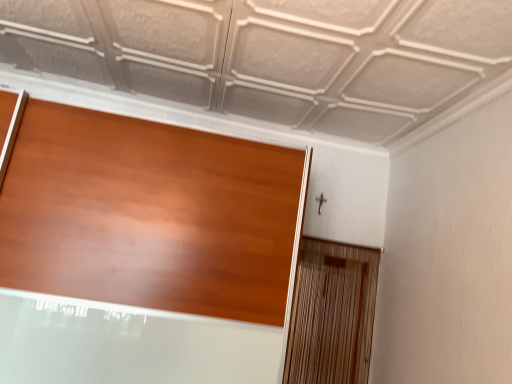
What is the approximate width of matte wood door at center?

26.78 inches.

Image resolution: width=512 pixels, height=384 pixels. What do you see at coordinates (148, 215) in the screenshot?
I see `matte wood door at center` at bounding box center [148, 215].

You are a GUI agent. You are given a task and a screenshot of the screen. Output one action in this format:
    pyautogui.click(x=<x>, y=<y>)
    Task: Click on the matte wood door at center
    Image resolution: width=512 pixels, height=384 pixels.
    Given the screenshot: What is the action you would take?
    pyautogui.click(x=148, y=215)

What is the approximate width of wooden screen door at right?

It is 7.03 centimeters.

The height and width of the screenshot is (384, 512). I want to click on wooden screen door at right, so click(332, 314).

The image size is (512, 384). Describe the element at coordinates (332, 314) in the screenshot. I see `wooden screen door at right` at that location.

Where is `matte wood door at center`? This screenshot has height=384, width=512. matte wood door at center is located at coordinates (148, 215).

Does wooden screen door at right appear on the right side of matte wood door at center?

Yes.

Is wooden screen door at right closer to camera compared to matte wood door at center?

No.

Which is behind, point (306, 371) or point (184, 295)?

The point (306, 371) is behind.

From the image's perspective, is wooden screen door at right over matte wood door at center?

No, from the image's perspective, wooden screen door at right is not above matte wood door at center.

Consider the image. From a real-world perspective, who is located lower, wooden screen door at right or matte wood door at center?

From a 3D spatial view, wooden screen door at right is below.

In the scene shown: Considering the relative sizes of wooden screen door at right and matte wood door at center in the image provided, is wooden screen door at right wider than matte wood door at center?

Incorrect, the width of wooden screen door at right does not surpass that of matte wood door at center.

From their relative heights in the image, would you say wooden screen door at right is taller or shorter than matte wood door at center?

Considering their sizes, wooden screen door at right has less height than matte wood door at center.

Who is bigger, wooden screen door at right or matte wood door at center?

matte wood door at center.

Is wooden screen door at right located outside matte wood door at center?

wooden screen door at right is positioned outside matte wood door at center.

Is wooden screen door at right not close to matte wood door at center?

No, wooden screen door at right is not far from matte wood door at center.

Is wooden screen door at right facing away from matte wood door at center?

wooden screen door at right does not have its back to matte wood door at center.

How different are the orientations of wooden screen door at right and matte wood door at center in degrees?

1.26 degrees separate the facing orientations of wooden screen door at right and matte wood door at center.

This screenshot has width=512, height=384. I want to click on door to the left of wooden screen door at right, so click(148, 215).

Visually, is matte wood door at center positioned to the left or to the right of wooden screen door at right?

From the image, it's evident that matte wood door at center is to the left of wooden screen door at right.

Does matte wood door at center lie behind wooden screen door at right?

That is False.

Is point (117, 167) more distant than point (298, 264)?

No.

From the image's perspective, relative to wooden screen door at right, is matte wood door at center above or below?

Based on their image positions, matte wood door at center is located above wooden screen door at right.

From a real-world perspective, which is physically above, matte wood door at center or wooden screen door at right?

matte wood door at center.

In terms of width, does matte wood door at center look wider or thinner when compared to wooden screen door at right?

Considering their sizes, matte wood door at center looks broader than wooden screen door at right.

From their relative heights in the image, would you say matte wood door at center is taller or shorter than wooden screen door at right?

matte wood door at center is taller than wooden screen door at right.

Looking at the image, does matte wood door at center seem bigger or smaller compared to wooden screen door at right?

In the image, matte wood door at center appears to be larger than wooden screen door at right.

Does matte wood door at center contain wooden screen door at right?

No, wooden screen door at right is located outside of matte wood door at center.

Are matte wood door at center and wooden screen door at right making contact?

No, matte wood door at center is not in contact with wooden screen door at right.

Is wooden screen door at right at the back of matte wood door at center?

No, matte wood door at center is not facing the opposite direction of wooden screen door at right.

How different are the orientations of matte wood door at center and wooden screen door at right in degrees?

1.26 degrees separate the facing orientations of matte wood door at center and wooden screen door at right.

This screenshot has width=512, height=384. In the image, there is a matte wood door at center. What are the coordinates of `screen door below it (from the image's perspective)` in the screenshot? It's located at (332, 314).

The height and width of the screenshot is (384, 512). I want to click on screen door behind the matte wood door at center, so click(x=332, y=314).

At what (x,y) coordinates should I click in order to perform the action: click on door above the wooden screen door at right (from a real-world perspective). Please return your answer as a coordinate pair (x, y). Looking at the image, I should click on [148, 215].